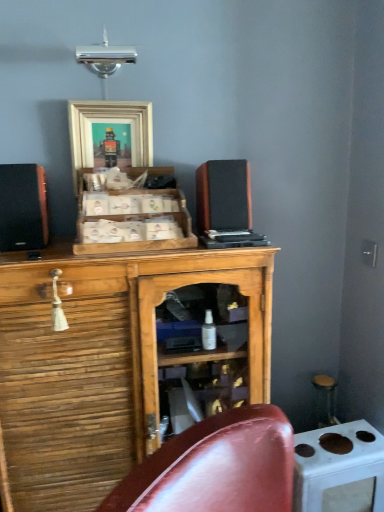
Identify the location of vacant space in front of matte black speaker at left, positioned as the first speaker in left-to-right order. This screenshot has width=384, height=512. (33, 256).